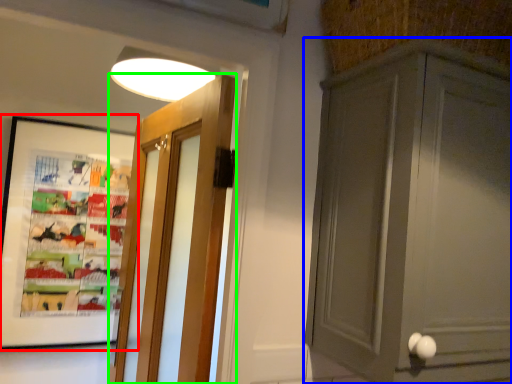
Question: Based on their relative distances, which object is farther from picture frame (highlighted by a red box)? Choose from cabinetry (highlighted by a blue box) and door (highlighted by a green box).

Choices:
 (A) cabinetry
 (B) door

Answer: (A)